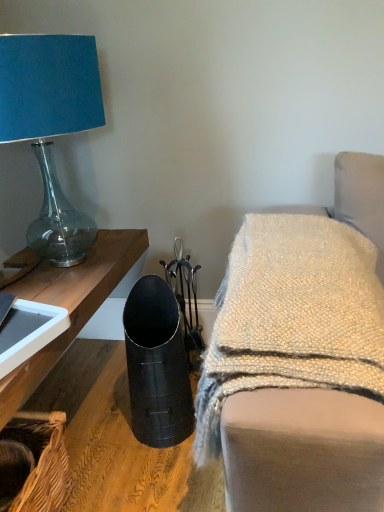
In order to face metallic black vase at lower left, should I rotate leftwards or rightwards?

It's best to rotate right around 14.337 degrees.

What is the approximate height of woven brown basket at lower left?

woven brown basket at lower left is 7.44 inches in height.

This screenshot has width=384, height=512. I want to click on matte blue fabric lampshade at upper left, so click(50, 108).

Would you say woven brown basket at lower left is a long distance from matte blue fabric lampshade at upper left?

That's not correct — woven brown basket at lower left is a little close to matte blue fabric lampshade at upper left.

Is matte blue fabric lampshade at upper left inside woven brown basket at lower left?

No, woven brown basket at lower left does not contain matte blue fabric lampshade at upper left.

Consider the image. Considering the relative sizes of woven brown basket at lower left and matte blue fabric lampshade at upper left in the image provided, is woven brown basket at lower left taller than matte blue fabric lampshade at upper left?

Result: In fact, woven brown basket at lower left may be shorter than matte blue fabric lampshade at upper left.

Is point (26, 479) closer to camera compared to point (81, 213)?

Yes, point (26, 479) is in front of point (81, 213).

From their relative heights in the image, would you say matte blue fabric lampshade at upper left is taller or shorter than woven brown basket at lower left?

matte blue fabric lampshade at upper left is taller than woven brown basket at lower left.

In the scene shown: How distant is matte blue fabric lampshade at upper left from woven brown basket at lower left?

matte blue fabric lampshade at upper left is 36.67 inches from woven brown basket at lower left.

In terms of size, does matte blue fabric lampshade at upper left appear bigger or smaller than woven brown basket at lower left?

matte blue fabric lampshade at upper left is bigger than woven brown basket at lower left.

In terms of width, does matte blue fabric lampshade at upper left look wider or thinner when compared to woven brown basket at lower left?

Clearly, matte blue fabric lampshade at upper left has more width compared to woven brown basket at lower left.

In the scene shown: Can you confirm if metallic black vase at lower left is smaller than matte blue fabric lampshade at upper left?

Correct, metallic black vase at lower left occupies less space than matte blue fabric lampshade at upper left.

Does metallic black vase at lower left have a lesser width compared to matte blue fabric lampshade at upper left?

No, metallic black vase at lower left is not thinner than matte blue fabric lampshade at upper left.

Is metallic black vase at lower left located outside matte blue fabric lampshade at upper left?

Indeed, metallic black vase at lower left is completely outside matte blue fabric lampshade at upper left.

Is matte blue fabric lampshade at upper left at the back of metallic black vase at lower left?

No.

Considering the positions of point (374, 371) and point (60, 485), is point (374, 371) closer or farther from the camera than point (60, 485)?

Point (374, 371) appears to be closer to the viewer than point (60, 485).

Is metallic black vase at lower left in contact with woven brown basket at lower left?

No.

From a real-world perspective, is metallic black vase at lower left beneath woven brown basket at lower left?

No, from a real-world perspective, metallic black vase at lower left is not under woven brown basket at lower left.

Is the depth of metallic black vase at lower left greater than that of woven brown basket at lower left?

No, it is not.

From the image's perspective, does woven brown basket at lower left appear higher than metallic black vase at lower left?

No.

Who is smaller, woven brown basket at lower left or metallic black vase at lower left?

woven brown basket at lower left.

Is woven brown basket at lower left facing towards metallic black vase at lower left?

No, woven brown basket at lower left is not aimed at metallic black vase at lower left.

Are woven brown basket at lower left and metallic black vase at lower left beside each other?

No, woven brown basket at lower left is not beside metallic black vase at lower left.

The height and width of the screenshot is (512, 384). I want to click on furniture on the right of matte blue fabric lampshade at upper left, so click(x=296, y=369).

Between matte blue fabric lampshade at upper left and metallic black vase at lower left, which one appears on the right side from the viewer's perspective?

metallic black vase at lower left.

From a real-world perspective, which is physically below, matte blue fabric lampshade at upper left or metallic black vase at lower left?

metallic black vase at lower left.

Is matte blue fabric lampshade at upper left not close to metallic black vase at lower left?

No, matte blue fabric lampshade at upper left is not far from metallic black vase at lower left.

Where is `basket below the matte blue fabric lampshade at upper left (from the image's perspective)`? The image size is (384, 512). basket below the matte blue fabric lampshade at upper left (from the image's perspective) is located at coordinates (41, 461).

The image size is (384, 512). Identify the location of lamp on the right of woven brown basket at lower left. (50, 108).

Looking at the image, which one is located further to woven brown basket at lower left, metallic black vase at lower left or matte blue fabric lampshade at upper left?

Based on the image, matte blue fabric lampshade at upper left appears to be further to woven brown basket at lower left.

Looking at the image, which one is located further to matte blue fabric lampshade at upper left, woven brown basket at lower left or metallic black vase at lower left?

woven brown basket at lower left.

When comparing their distances from metallic black vase at lower left, does matte blue fabric lampshade at upper left or woven brown basket at lower left seem further?

matte blue fabric lampshade at upper left lies further to metallic black vase at lower left than the other object.

When comparing their distances from woven brown basket at lower left, does matte blue fabric lampshade at upper left or metallic black vase at lower left seem closer?

metallic black vase at lower left lies closer to woven brown basket at lower left than the other object.

Which object lies further to the anchor point metallic black vase at lower left, woven brown basket at lower left or matte blue fabric lampshade at upper left?

Based on the image, matte blue fabric lampshade at upper left appears to be further to metallic black vase at lower left.

Estimate the real-world distances between objects in this image. Which object is further from matte blue fabric lampshade at upper left, metallic black vase at lower left or woven brown basket at lower left?

woven brown basket at lower left.

Where is `furniture between matte blue fabric lampshade at upper left and woven brown basket at lower left from top to bottom`? The image size is (384, 512). furniture between matte blue fabric lampshade at upper left and woven brown basket at lower left from top to bottom is located at coordinates (296, 369).